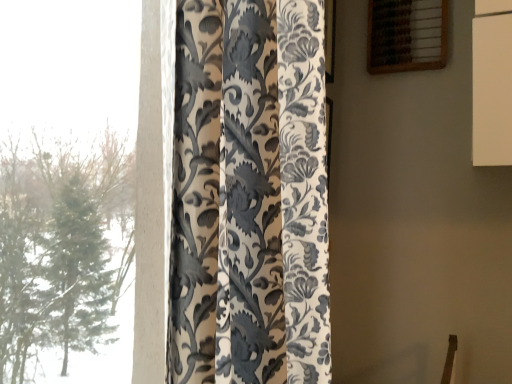
Question: Relative to wooden abacus at upper right, is silky floral-patterned curtain at left in front or behind?

Choices:
 (A) front
 (B) behind

Answer: (A)

Question: Is silky floral-patterned curtain at left bigger or smaller than wooden abacus at upper right?

Choices:
 (A) small
 (B) big

Answer: (B)

Question: From the image's perspective, is silky floral-patterned curtain at left positioned above or below wooden abacus at upper right?

Choices:
 (A) below
 (B) above

Answer: (A)

Question: Based on their sizes in the image, would you say wooden abacus at upper right is bigger or smaller than silky floral-patterned curtain at left?

Choices:
 (A) big
 (B) small

Answer: (B)

Question: Relative to silky floral-patterned curtain at left, is wooden abacus at upper right in front or behind?

Choices:
 (A) front
 (B) behind

Answer: (B)

Question: From a real-world perspective, is wooden abacus at upper right above or below silky floral-patterned curtain at left?

Choices:
 (A) below
 (B) above

Answer: (B)

Question: Considering the positions of wooden abacus at upper right and silky floral-patterned curtain at left in the image, is wooden abacus at upper right taller or shorter than silky floral-patterned curtain at left?

Choices:
 (A) short
 (B) tall

Answer: (A)